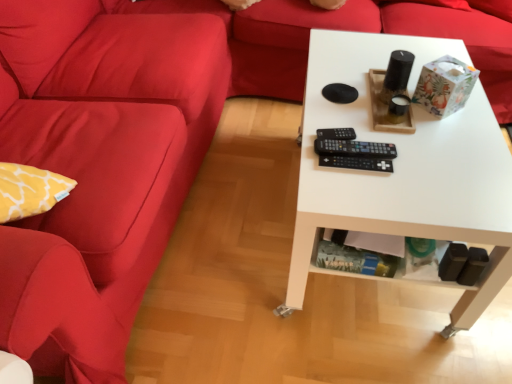
At what (x,y) coordinates should I click in order to perform the action: click on unoccupied area in front of black plastic remote at center, positioned as the second control in bottom-to-top order. Please return your answer as a coordinate pair (x, y). The image size is (512, 384). Looking at the image, I should click on (369, 187).